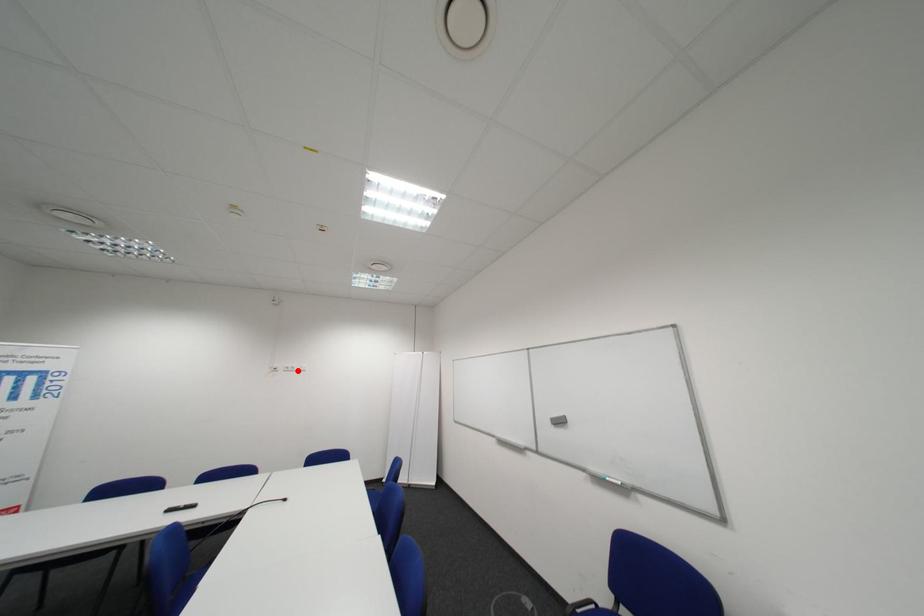
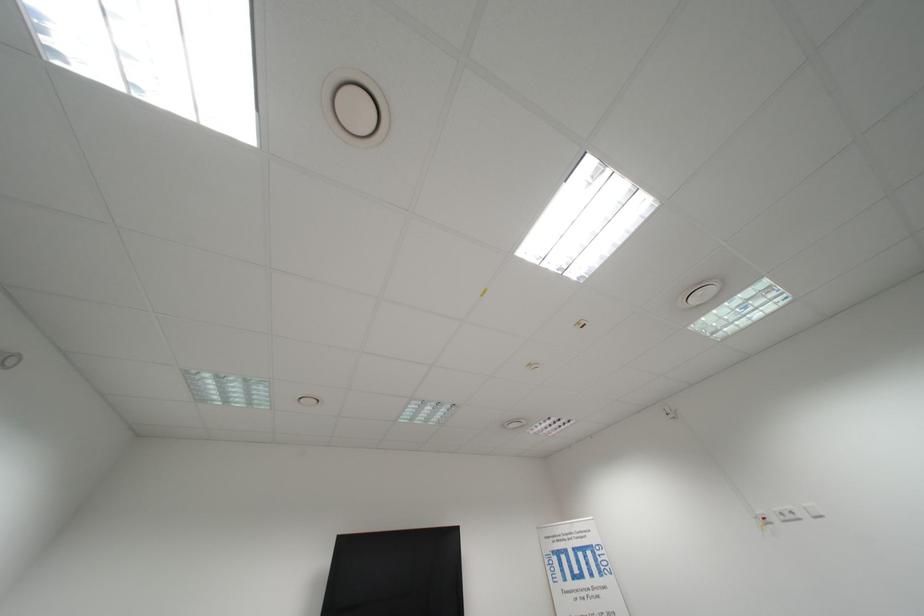
Locate, in the second image, the point that corresponds to the highlighted location in the first image.

(796, 519)